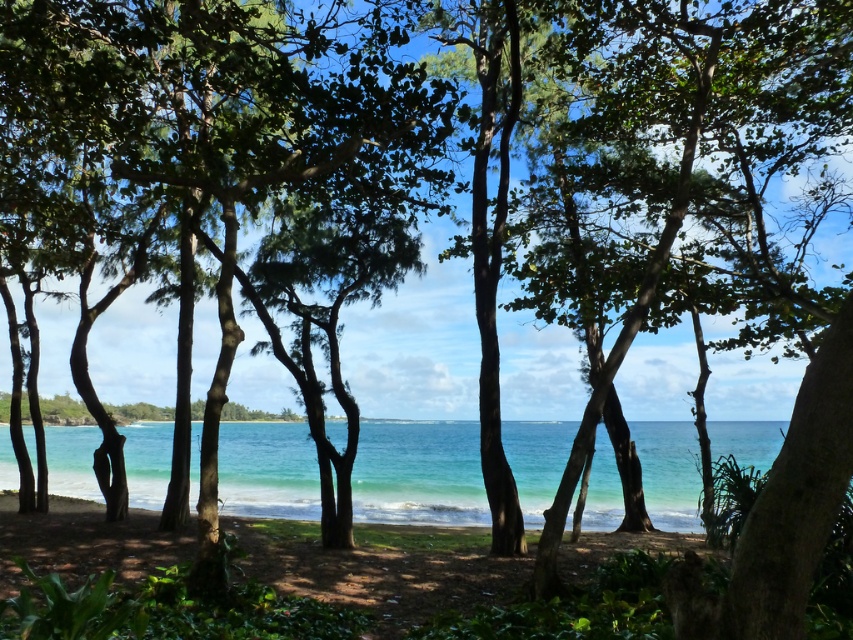
Question: Among these points, which one is nearest to the camera?

Choices:
 (A) (641, 534)
 (B) (395, 493)

Answer: (A)

Question: Can you confirm if clear blue water at center is positioned below green sand at center?

Choices:
 (A) yes
 (B) no

Answer: (B)

Question: Which point is farther from the camera taking this photo?

Choices:
 (A) (48, 467)
 (B) (521, 577)

Answer: (A)

Question: Does clear blue water at center appear under green sand at center?

Choices:
 (A) no
 (B) yes

Answer: (A)

Question: Can you confirm if clear blue water at center is positioned below green sand at center?

Choices:
 (A) no
 (B) yes

Answer: (A)